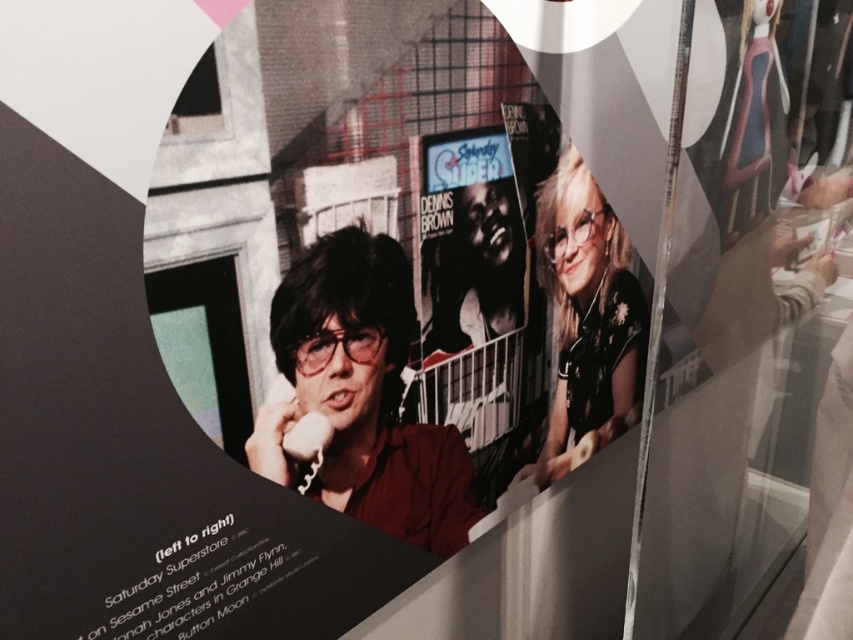
In the scene shown: Where is the matte black man at center located in the image?

The matte black man at center is located at point (363, 396) in the image.

You are standing in front of the exhibit and want to take a photo of the matte black man at center and the black glossy poster at center. Which one is positioned to the left?

The matte black man at center is to the left of the black glossy poster at center.

You are an art curator planning to install a new spotlight in this exhibit. The spotlight needs to be placed such that it can illuminate both the point at coordinates point (633, 365) and point (438, 234) without any obstruction. Considering their spatial relationship, where should the spotlight be positioned relative to these points?

The spotlight should be placed in front of both points since point (633, 365) is behind point (438, 234), ensuring that the light can reach both without obstruction.